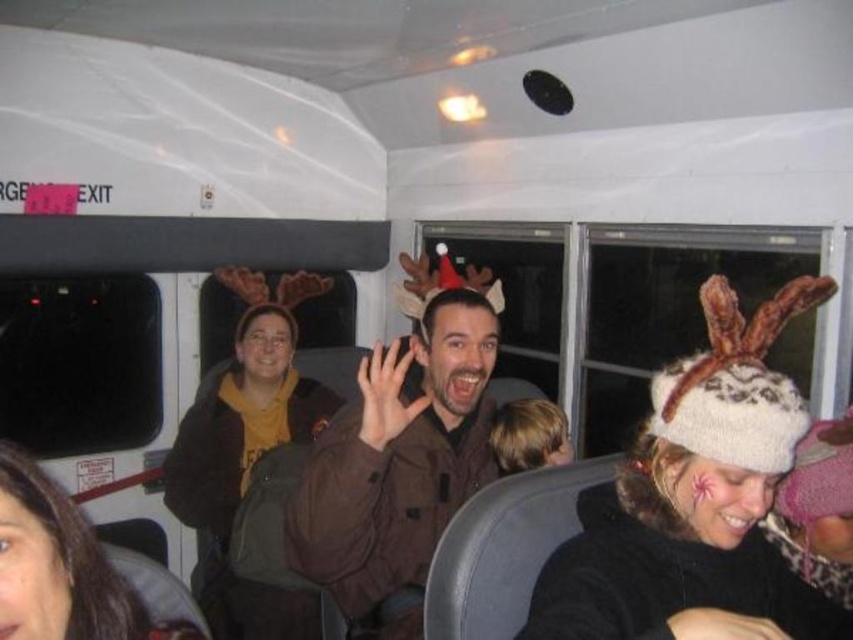
Looking at this image, you are standing at the entrance of the bus and want to give a gift to the person wearing the brown matte jacket at center. Based on their position, which direction should you move to reach them?

The brown matte jacket at center is located at point (x=398, y=458), so you should move towards the center of the bus to reach them.

You are a photographer trying to capture both the brown matte jacket at center and the brown fuzzy jacket at center in a single frame. Since you want to include both jackets fully, which jacket should you focus on adjusting the camera angle for to ensure it fits in the photo?

The brown matte jacket at center occupies less space than the brown fuzzy jacket at center, so you should focus on adjusting the camera angle to ensure the larger brown fuzzy jacket at center fits in the photo.